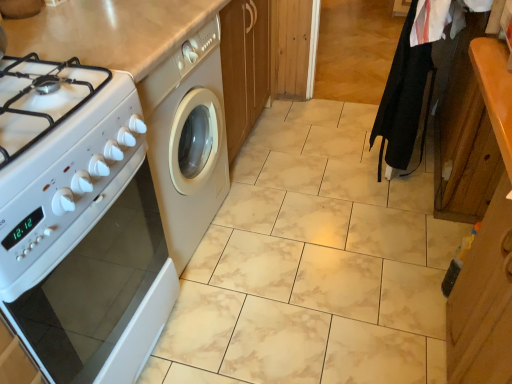
Question: Can you confirm if white glossy oven at left is taller than black fabric robe at right?

Choices:
 (A) no
 (B) yes

Answer: (A)

Question: Is black fabric robe at right surrounded by white glossy oven at left?

Choices:
 (A) no
 (B) yes

Answer: (A)

Question: Is white glossy oven at left oriented towards black fabric robe at right?

Choices:
 (A) no
 (B) yes

Answer: (A)

Question: Are white glossy oven at left and black fabric robe at right making contact?

Choices:
 (A) no
 (B) yes

Answer: (A)

Question: From a real-world perspective, is white glossy oven at left under black fabric robe at right?

Choices:
 (A) no
 (B) yes

Answer: (B)

Question: Is white glossy oven at left further to camera compared to black fabric robe at right?

Choices:
 (A) no
 (B) yes

Answer: (A)

Question: Is black fabric robe at right next to white glossy oven at left?

Choices:
 (A) yes
 (B) no

Answer: (B)

Question: Is black fabric robe at right behind white glossy oven at left?

Choices:
 (A) yes
 (B) no

Answer: (A)

Question: Is black fabric robe at right not within white glossy oven at left?

Choices:
 (A) yes
 (B) no

Answer: (A)

Question: From the image's perspective, is black fabric robe at right over white glossy oven at left?

Choices:
 (A) no
 (B) yes

Answer: (B)

Question: Does black fabric robe at right lie in front of white glossy oven at left?

Choices:
 (A) yes
 (B) no

Answer: (B)

Question: Is black fabric robe at right taller than white glossy oven at left?

Choices:
 (A) yes
 (B) no

Answer: (A)

Question: Is white glossy oven at left thinner than wooden cabinet at right?

Choices:
 (A) yes
 (B) no

Answer: (B)